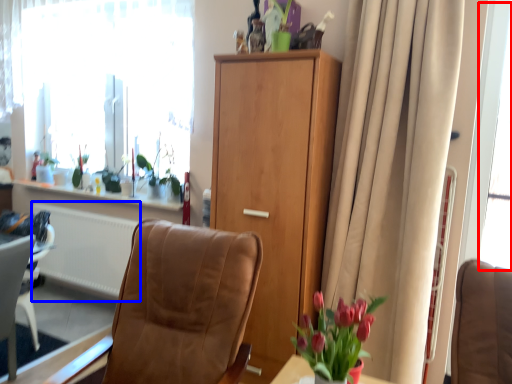
Question: Among these objects, which one is nearest to the camera, window screen (highlighted by a red box) or radiator (highlighted by a blue box)?

Choices:
 (A) window screen
 (B) radiator

Answer: (A)